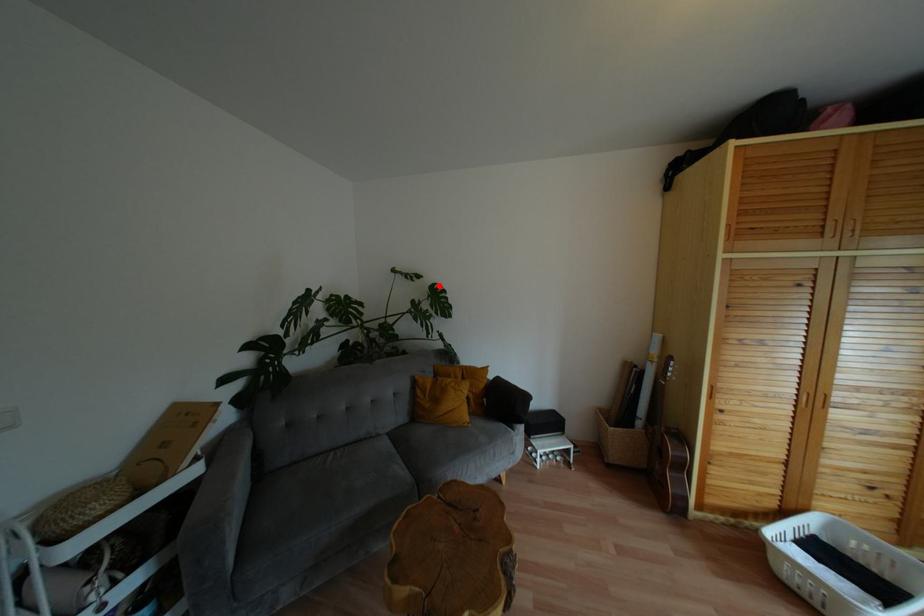
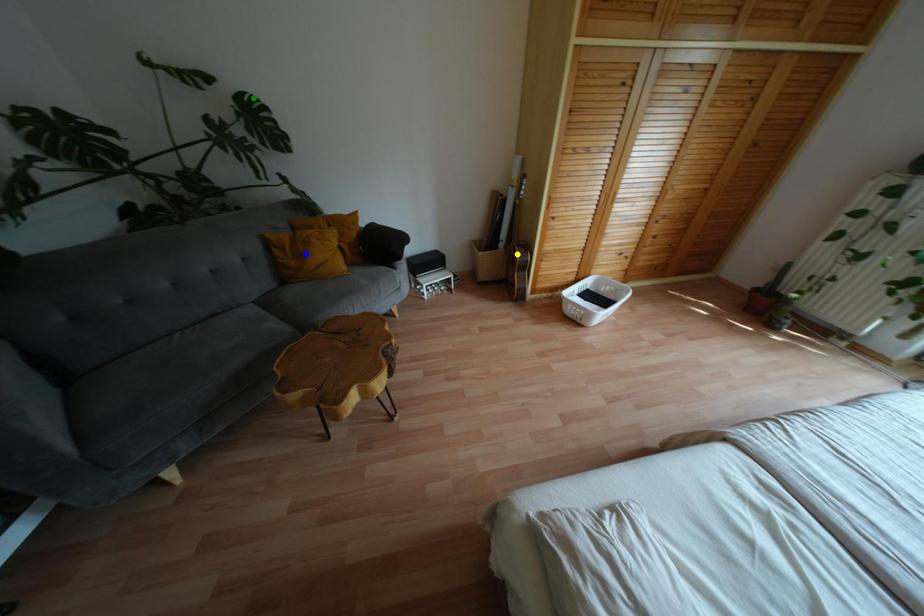
Question: I am providing you with two images of the same scene from different viewpoints. A red point is marked on the first image. You are given multiple points on the second image. Which spot in image 2 lines up with the point in image 1?

Choices:
 (A) blue point
 (B) green point
 (C) yellow point

Answer: (B)